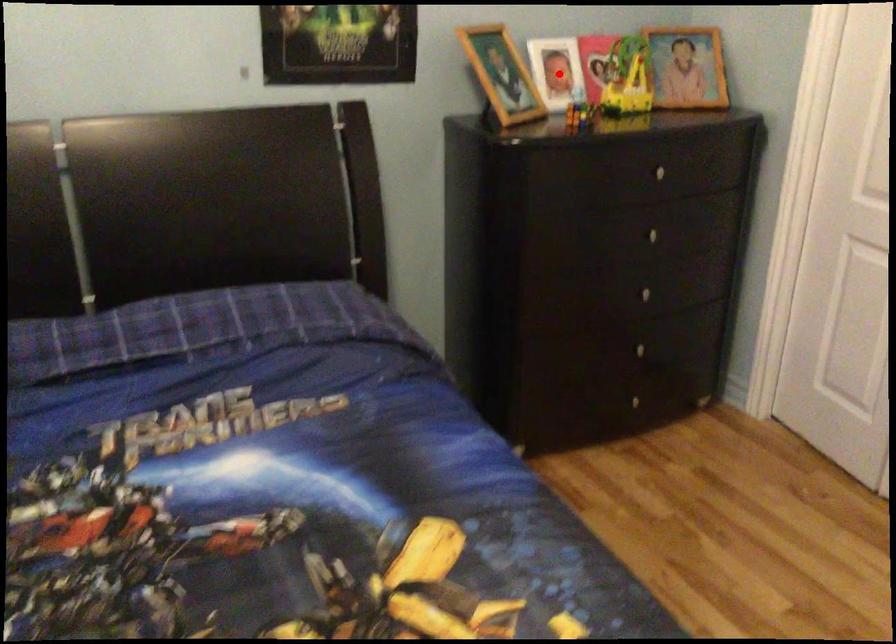
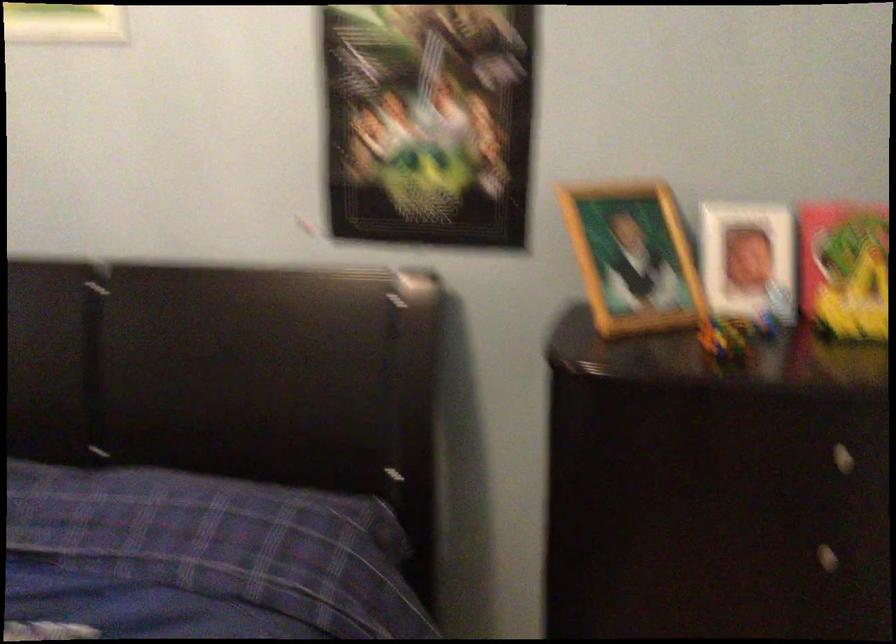
In the second image, find the point that corresponds to the highlighted location in the first image.

(748, 261)